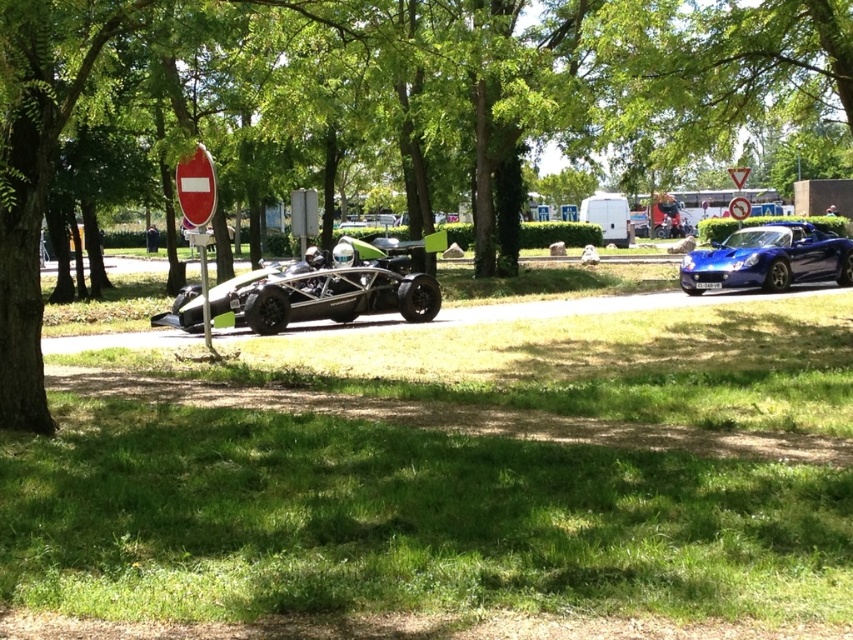
Question: Is green grass at lower center to the right of shiny blue car at center from the viewer's perspective?

Choices:
 (A) no
 (B) yes

Answer: (A)

Question: Considering the real-world distances, which object is farthest from the green leafy tree at center?

Choices:
 (A) shiny silver sports car at center
 (B) shiny blue car at center

Answer: (B)

Question: Which point is farther to the camera?

Choices:
 (A) shiny silver sports car at center
 (B) green grass at lower center
 (C) green leafy tree at center

Answer: (A)

Question: Does green grass at lower center lie behind shiny blue car at center?

Choices:
 (A) no
 (B) yes

Answer: (A)

Question: Considering the real-world distances, which object is closest to the glossy blue sports car at right?

Choices:
 (A) green leafy tree at center
 (B) shiny silver sports car at center

Answer: (A)

Question: Observing the image, what is the correct spatial positioning of green leafy tree at center in reference to shiny silver sports car at center?

Choices:
 (A) below
 (B) above

Answer: (B)